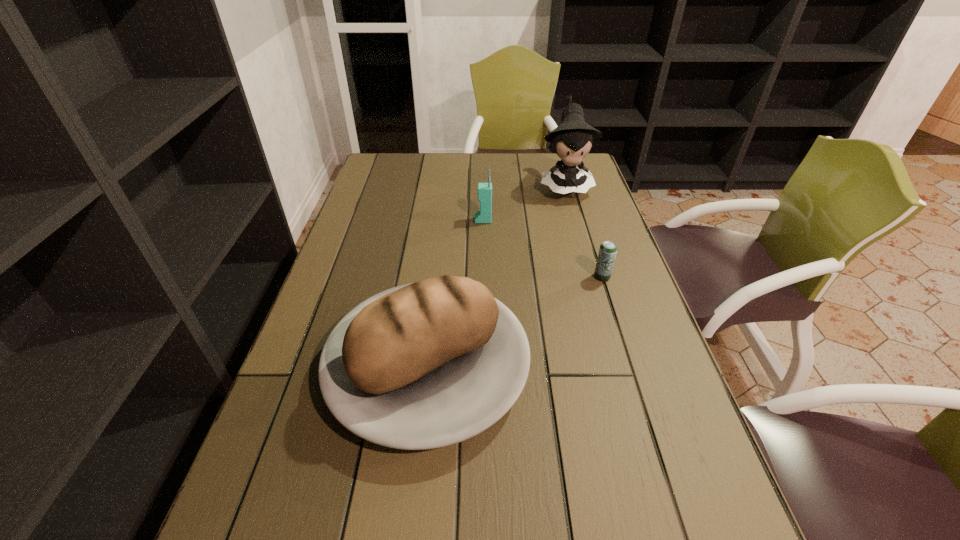
Where is `free space located 0.060m on the keypad of the cellular telephone`? This screenshot has height=540, width=960. free space located 0.060m on the keypad of the cellular telephone is located at coordinates (455, 220).

In order to click on vacant region located on the left of the beer can in this screenshot , I will do `click(463, 277)`.

Locate an element on the screen. This screenshot has height=540, width=960. object located in the far edge section of the desktop is located at coordinates (572, 140).

Locate an element on the screen. object that is at the left edge is located at coordinates (425, 365).

At what (x,y) coordinates should I click in order to perform the action: click on doll that is at the right edge. Please return your answer as a coordinate pair (x, y). The height and width of the screenshot is (540, 960). Looking at the image, I should click on (572, 140).

Locate an element on the screen. The height and width of the screenshot is (540, 960). beer can situated at the right edge is located at coordinates (607, 253).

Find the location of a particular element. This screenshot has height=540, width=960. object that is at the far right corner is located at coordinates (572, 140).

You are a GUI agent. You are given a task and a screenshot of the screen. Output one action in this format:
    pyautogui.click(x=<x>, y=<y>)
    Task: Click on the blank space at the far edge of the desktop
    
    Given the screenshot: What is the action you would take?
    pyautogui.click(x=428, y=174)

Locate an element on the screen. The height and width of the screenshot is (540, 960). free location at the left edge is located at coordinates (380, 271).

In the image, there is a desktop. Identify the location of vacant space at the right edge. The width and height of the screenshot is (960, 540). (629, 372).